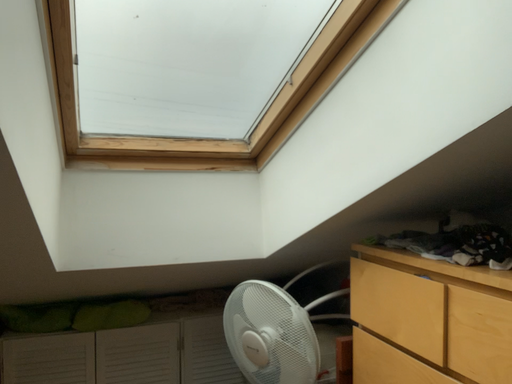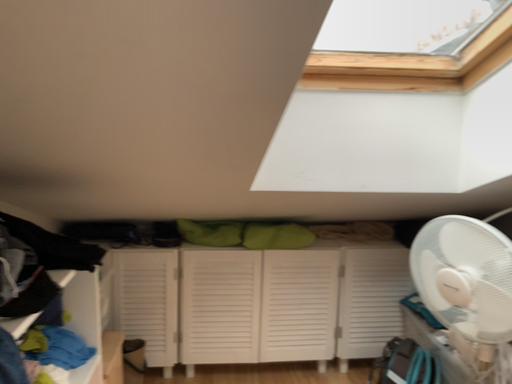
Question: Which way did the camera rotate in the video?

Choices:
 (A) rotated right
 (B) rotated left

Answer: (B)